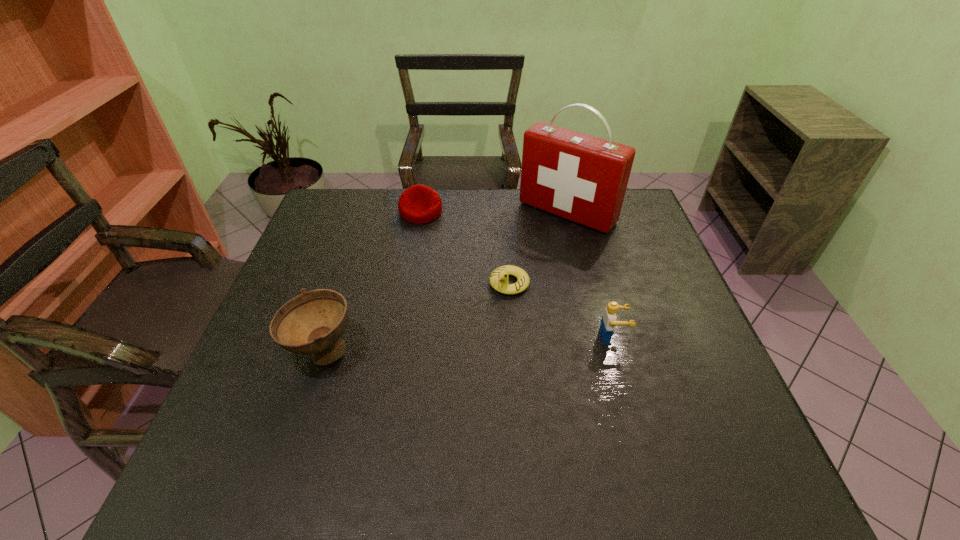
This screenshot has width=960, height=540. Find the location of `soup bowl`. soup bowl is located at coordinates (313, 322).

You are a GUI agent. You are given a task and a screenshot of the screen. Output one action in this format:
    pyautogui.click(x=<x>, y=<y>)
    Task: Click on the leftmost object
    This screenshot has width=960, height=540.
    Given the screenshot: What is the action you would take?
    pyautogui.click(x=313, y=322)

Identify the location of Lego. The width and height of the screenshot is (960, 540). (608, 321).

You are a GUI agent. You are given a task and a screenshot of the screen. Output one action in this format:
    pyautogui.click(x=<x>, y=<y>)
    Task: Click on the duckling
    The width and height of the screenshot is (960, 540).
    Given the screenshot: What is the action you would take?
    pyautogui.click(x=499, y=279)

Where is `the tallest object`? This screenshot has width=960, height=540. the tallest object is located at coordinates (582, 178).

Identify the location of the fourth object from right to left. (418, 204).

Locate an element on the screen. The width and height of the screenshot is (960, 540). vacant space situated on the back of the soup bowl is located at coordinates [x=359, y=242].

This screenshot has height=540, width=960. What are the coordinates of `vacant point located on the face of the third tallest object` in the screenshot? It's located at (696, 337).

Locate an element on the screen. The height and width of the screenshot is (540, 960). vacant space located on the face of the duckling is located at coordinates (447, 350).

Locate an element on the screen. The width and height of the screenshot is (960, 540). free region located 0.240m on the face of the duckling is located at coordinates (442, 356).